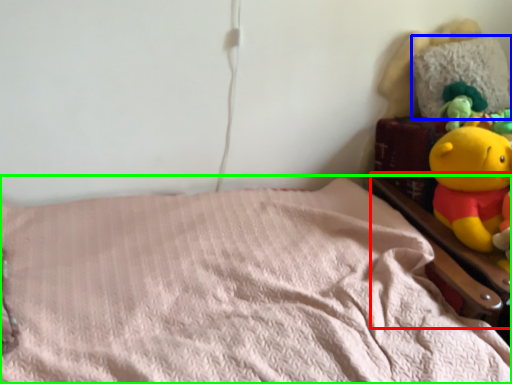
Question: Which object is the closest to the bed frame (highlighted by a red box)? Choose among these: pillow (highlighted by a blue box) or bed (highlighted by a green box).

Choices:
 (A) pillow
 (B) bed

Answer: (B)